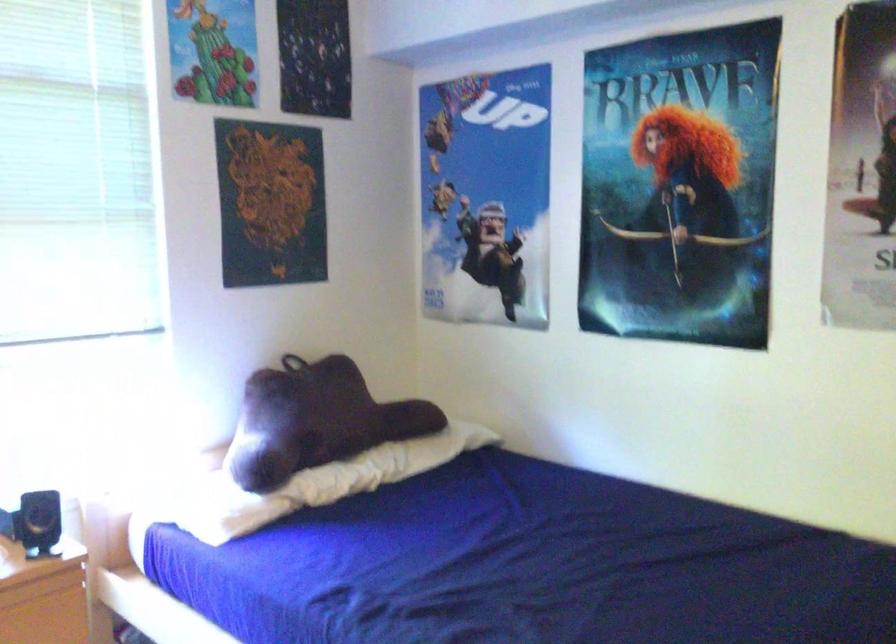
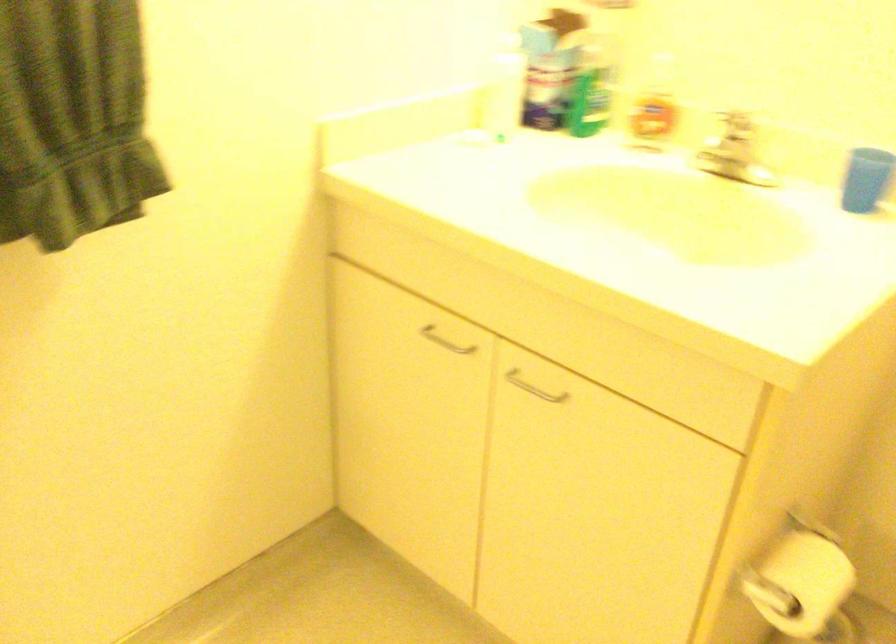
Which direction would the cameraman need to move to produce the second image?

The movement direction of the cameraman is right, backward.